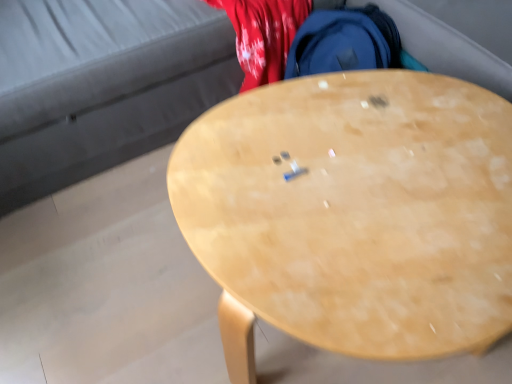
Question: Is velvet grey couch at upper center next to light wood desk at center and touching it?

Choices:
 (A) yes
 (B) no

Answer: (B)

Question: Is the depth of velvet grey couch at upper center less than that of light wood desk at center?

Choices:
 (A) yes
 (B) no

Answer: (B)

Question: Are velvet grey couch at upper center and light wood desk at center located far from each other?

Choices:
 (A) no
 (B) yes

Answer: (A)

Question: From the image's perspective, would you say velvet grey couch at upper center is shown under light wood desk at center?

Choices:
 (A) yes
 (B) no

Answer: (B)

Question: Can you confirm if velvet grey couch at upper center is positioned to the left of light wood desk at center?

Choices:
 (A) yes
 (B) no

Answer: (A)

Question: Is velvet grey couch at upper center thinner than light wood desk at center?

Choices:
 (A) yes
 (B) no

Answer: (B)

Question: From the image's perspective, is light wood desk at center above velvet grey couch at upper center?

Choices:
 (A) yes
 (B) no

Answer: (B)

Question: Does light wood desk at center have a lesser width compared to velvet grey couch at upper center?

Choices:
 (A) yes
 (B) no

Answer: (A)

Question: Can you confirm if light wood desk at center is bigger than velvet grey couch at upper center?

Choices:
 (A) no
 (B) yes

Answer: (A)

Question: Is light wood desk at center closer to the viewer compared to velvet grey couch at upper center?

Choices:
 (A) no
 (B) yes

Answer: (B)

Question: From a real-world perspective, is light wood desk at center below velvet grey couch at upper center?

Choices:
 (A) yes
 (B) no

Answer: (A)

Question: Is light wood desk at center to the left of velvet grey couch at upper center from the viewer's perspective?

Choices:
 (A) yes
 (B) no

Answer: (B)

Question: From a real-world perspective, relative to light wood desk at center, is velvet grey couch at upper center vertically above or below?

Choices:
 (A) below
 (B) above

Answer: (B)